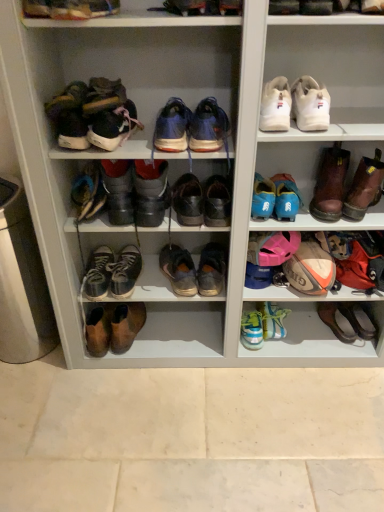
Locate an element on the screen. This screenshot has height=512, width=384. free location in front of brown leather shoe at lower right, positioned as the eleventh footwear in left-to-right order is located at coordinates (349, 353).